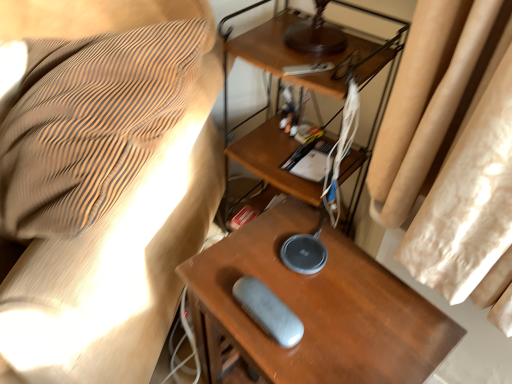
I want to click on vacant area located to the right-hand side of gray matte speaker at center, so click(349, 315).